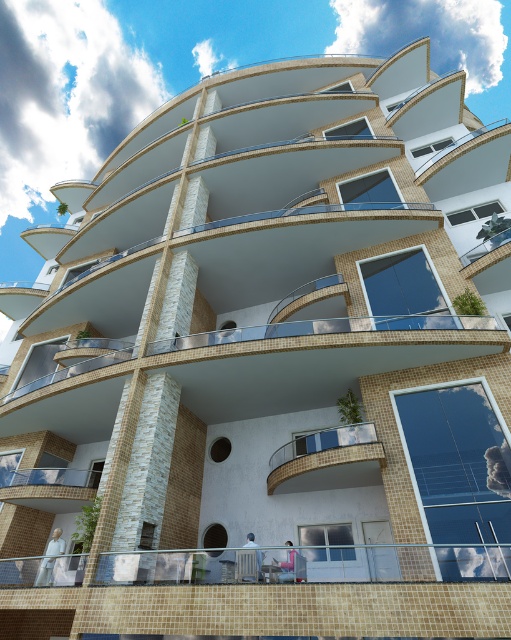
Question: Is white glossy balcony at center above glassy transparent balcony at lower left?

Choices:
 (A) yes
 (B) no

Answer: (A)

Question: Can you confirm if white glossy balcony at center is smaller than glassy transparent balcony at lower left?

Choices:
 (A) yes
 (B) no

Answer: (B)

Question: Which point is closer to the camera?

Choices:
 (A) glassy transparent balcony at lower left
 (B) white glossy balcony at center

Answer: (B)

Question: Is white glossy balcony at center wider than glassy transparent balcony at lower left?

Choices:
 (A) no
 (B) yes

Answer: (A)

Question: Which point appears farthest from the camera in this image?

Choices:
 (A) (85, 496)
 (B) (308, 467)

Answer: (A)

Question: Among these points, which one is farthest from the camera?

Choices:
 (A) (343, 436)
 (B) (66, 477)

Answer: (B)